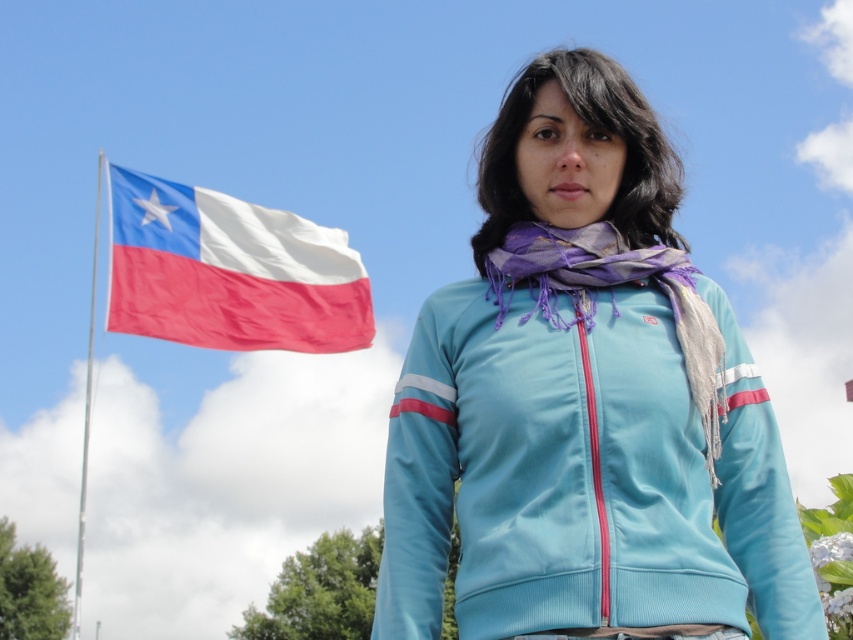
You are a photographer trying to capture the silver metallic flag pole at left in the background of your photo. However, the matte blue jacket at center is blocking your view. Can you still see the flag pole in the photo?

The matte blue jacket at center is in front of the silver metallic flag pole at left, so the flag pole is partially or fully blocked from view. You will not be able to see the silver metallic flag pole at left clearly in the photo.

What is the exact coordinate of the matte blue jacket at center?

The matte blue jacket at center is located at point (583,468).

You are a fashion designer observing the scene. You want to create a scarf that matches the silver metallic flag pole at left in width. Based on the image, will the purple silk scarf at center be a suitable reference for the width of the new scarf? Explain your reasoning.

The purple silk scarf at center has a width less than the silver metallic flag pole at left. Therefore, using the purple silk scarf at center as a reference would result in a scarf narrower than the flag pole. To match the flag pole at left, the new scarf should be wider than the purple silk scarf at center.